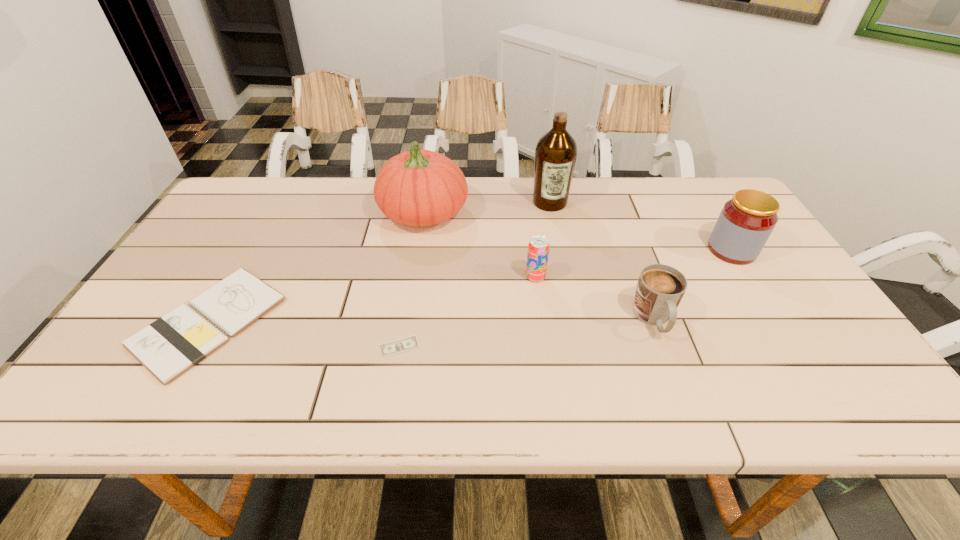
At what (x,y) coordinates should I click in order to perform the action: click on olive oil. Please return your answer as a coordinate pair (x, y). The height and width of the screenshot is (540, 960). Looking at the image, I should click on (556, 152).

Identify the location of pumpkin. The height and width of the screenshot is (540, 960). (422, 188).

Identify the location of jar. (746, 221).

What are the coordinates of `the rightmost object` in the screenshot? It's located at (746, 221).

I want to click on soda can, so click(x=538, y=248).

You are a GUI agent. You are given a task and a screenshot of the screen. Output one action in this format:
    pyautogui.click(x=<x>, y=<y>)
    Task: Click on the sixth object from left to right
    Image resolution: width=960 pixels, height=540 pixels.
    Given the screenshot: What is the action you would take?
    pyautogui.click(x=660, y=288)

I want to click on the second shortest object, so click(169, 346).

Where is `notepad`? notepad is located at coordinates (169, 346).

The width and height of the screenshot is (960, 540). I want to click on money, so click(x=405, y=344).

Where is `free point located on the label of the tallest object`? This screenshot has width=960, height=540. free point located on the label of the tallest object is located at coordinates (570, 305).